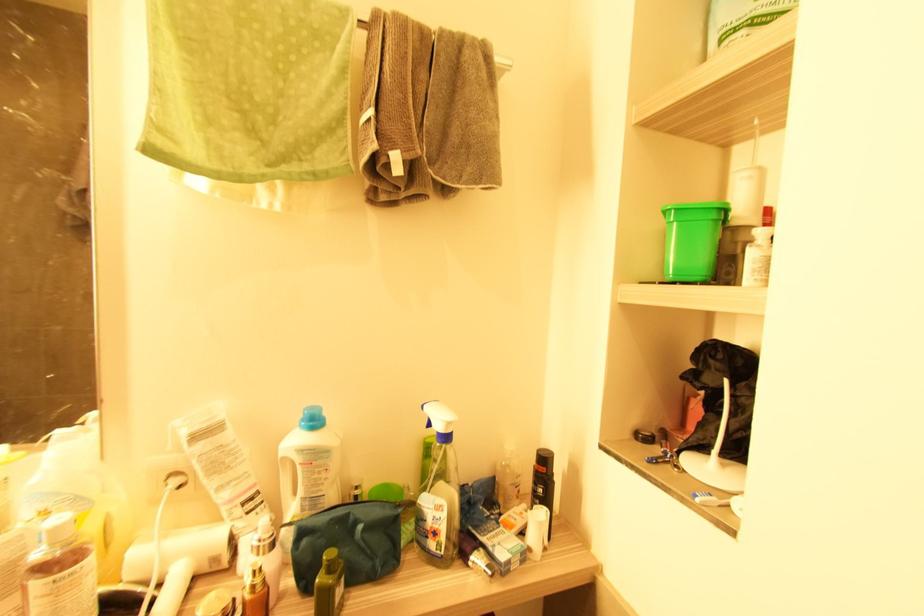
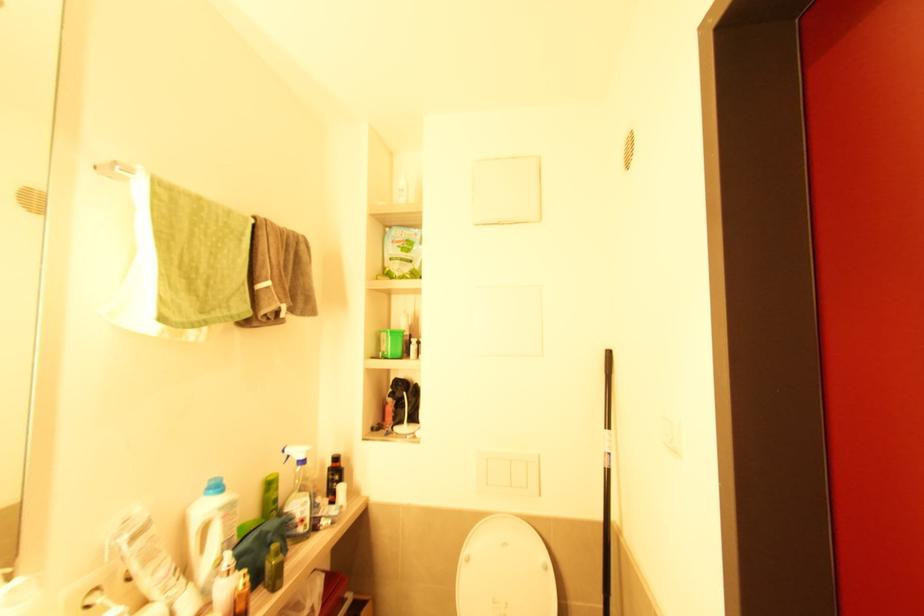
The point at (254, 588) is marked in the first image. Where is the corresponding point in the second image?

(247, 585)